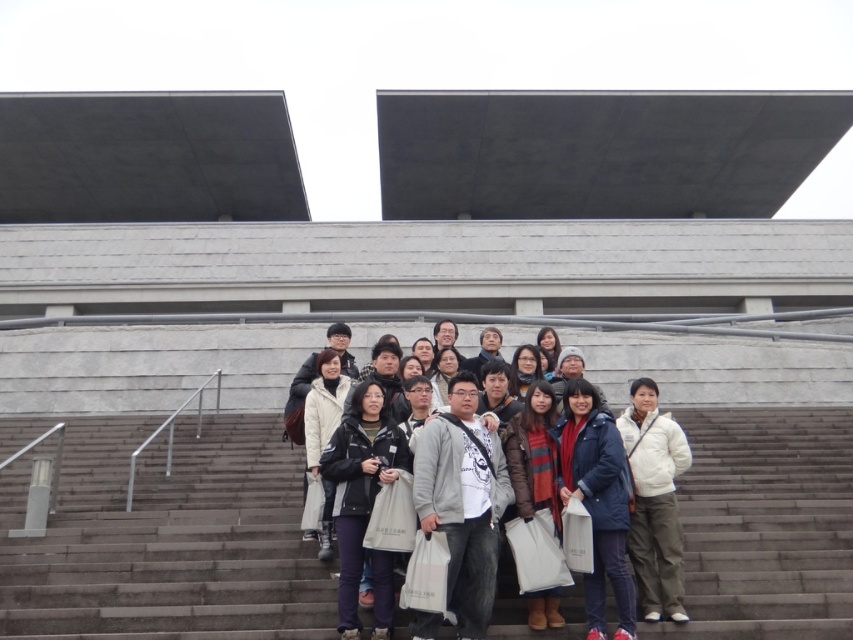
Question: Which point appears closest to the camera in this image?

Choices:
 (A) (532, 464)
 (B) (426, 397)

Answer: (A)

Question: Does white cotton jacket at center appear on the left side of gray fleece jacket at center?

Choices:
 (A) yes
 (B) no

Answer: (A)

Question: Which of the following is the closest to the observer?

Choices:
 (A) tap(515, 429)
 (B) tap(593, 428)

Answer: (B)

Question: Can you confirm if white cotton jacket at center is positioned above brown leather jacket at center?

Choices:
 (A) no
 (B) yes

Answer: (B)

Question: Is gray fleece jacket at center below dark blue jeans at center?

Choices:
 (A) no
 (B) yes

Answer: (A)

Question: Which of these objects is positioned closest to the blue down jacket at center?

Choices:
 (A) white cotton jacket at center
 (B) dark blue jeans at center
 (C) gray fleece jacket at center

Answer: (C)